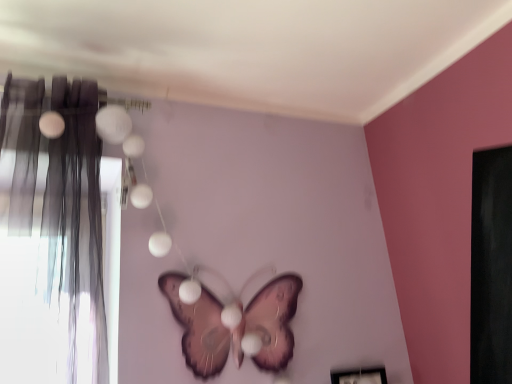
Question: From the image's perspective, is matte gray curtain at left located above or below pink matte butterfly at center?

Choices:
 (A) above
 (B) below

Answer: (A)

Question: Considering the positions of matte gray curtain at left and pink matte butterfly at center in the image, is matte gray curtain at left wider or thinner than pink matte butterfly at center?

Choices:
 (A) thin
 (B) wide

Answer: (B)

Question: Is matte gray curtain at left in front of or behind pink matte butterfly at center in the image?

Choices:
 (A) behind
 (B) front

Answer: (B)

Question: From a real-world perspective, relative to matte gray curtain at left, is pink matte butterfly at center vertically above or below?

Choices:
 (A) below
 (B) above

Answer: (A)

Question: Is point (203, 352) closer or farther from the camera than point (75, 185)?

Choices:
 (A) farther
 (B) closer

Answer: (A)

Question: In terms of size, does pink matte butterfly at center appear bigger or smaller than matte gray curtain at left?

Choices:
 (A) big
 (B) small

Answer: (B)

Question: From their relative heights in the image, would you say pink matte butterfly at center is taller or shorter than matte gray curtain at left?

Choices:
 (A) tall
 (B) short

Answer: (B)